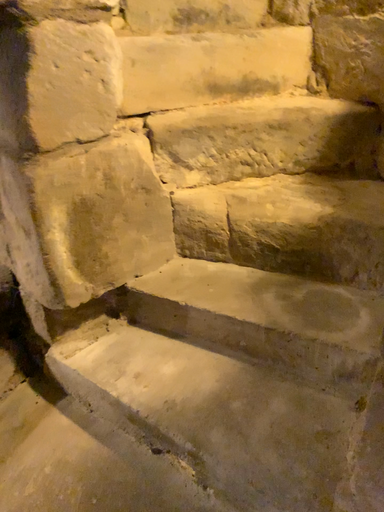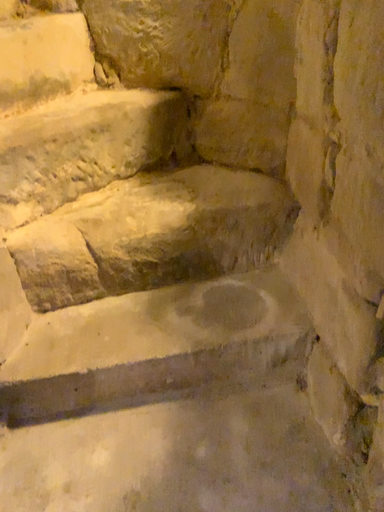
Question: Which way did the camera rotate in the video?

Choices:
 (A) rotated left
 (B) rotated right

Answer: (B)